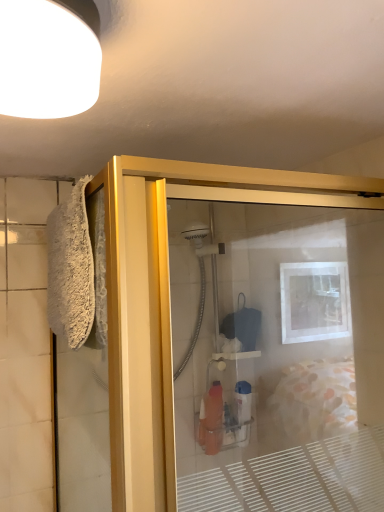
This screenshot has width=384, height=512. In order to click on gold metallic shower door at left in this screenshot , I will do `click(277, 351)`.

Describe the element at coordinates (49, 57) in the screenshot. I see `white matte light fixture at upper left` at that location.

This screenshot has height=512, width=384. I want to click on white fluffy bath towel at left, so click(71, 269).

Is gold metallic shower door at left bigger than white matte light fixture at upper left?

Yes, gold metallic shower door at left is bigger than white matte light fixture at upper left.

Could you tell me if gold metallic shower door at left is turned towards white matte light fixture at upper left?

No, gold metallic shower door at left is not turned towards white matte light fixture at upper left.

Can you confirm if white fluffy bath towel at left is taller than gold metallic shower door at left?

In fact, white fluffy bath towel at left may be shorter than gold metallic shower door at left.

Considering the relative sizes of white fluffy bath towel at left and gold metallic shower door at left in the image provided, is white fluffy bath towel at left thinner than gold metallic shower door at left?

Yes, white fluffy bath towel at left is thinner than gold metallic shower door at left.

Considering the points (88, 277) and (215, 218), which point is in front, point (88, 277) or point (215, 218)?

Point (88, 277)

Locate an element on the screen. This screenshot has height=512, width=384. light fixture above the gold metallic shower door at left (from a real-world perspective) is located at coordinates (49, 57).

How much distance is there between white matte light fixture at upper left and gold metallic shower door at left?

They are 88.74 centimeters apart.

How many degrees apart are the facing directions of white matte light fixture at upper left and gold metallic shower door at left?

The facing directions of white matte light fixture at upper left and gold metallic shower door at left are 89.5 degrees apart.

Consider the image. Does white matte light fixture at upper left have a lesser width compared to gold metallic shower door at left?

Indeed, white matte light fixture at upper left has a lesser width compared to gold metallic shower door at left.

In the image, is white matte light fixture at upper left positioned in front of or behind white fluffy bath towel at left?

Visually, white matte light fixture at upper left is located in front of white fluffy bath towel at left.

From a real-world perspective, who is located higher, white matte light fixture at upper left or white fluffy bath towel at left?

white matte light fixture at upper left.

Between white matte light fixture at upper left and white fluffy bath towel at left, which one has more height?

Standing taller between the two is white fluffy bath towel at left.

Is white matte light fixture at upper left to the left or to the right of white fluffy bath towel at left in the image?

Clearly, white matte light fixture at upper left is on the right of white fluffy bath towel at left in the image.

From a real-world perspective, is white fluffy bath towel at left on top of white matte light fixture at upper left?

Incorrect, from a real-world perspective, white fluffy bath towel at left is lower than white matte light fixture at upper left.

Could white matte light fixture at upper left be considered to be inside white fluffy bath towel at left?

No, white fluffy bath towel at left does not contain white matte light fixture at upper left.

Which object is further away from the camera taking this photo, white fluffy bath towel at left or white matte light fixture at upper left?

Positioned behind is white fluffy bath towel at left.

From the image's perspective, which object appears higher, white fluffy bath towel at left or white matte light fixture at upper left?

white matte light fixture at upper left, from the image's perspective.

Would you say white fluffy bath towel at left is part of gold metallic shower door at left's contents?

That's correct, white fluffy bath towel at left is inside gold metallic shower door at left.

From a real-world perspective, is gold metallic shower door at left located beneath white fluffy bath towel at left?

Yes, from a real-world perspective, gold metallic shower door at left is under white fluffy bath towel at left.

Which of these two, gold metallic shower door at left or white fluffy bath towel at left, is smaller?

white fluffy bath towel at left is smaller.

Locate an element on the screen. This screenshot has width=384, height=512. screen door in front of the white fluffy bath towel at left is located at coordinates (277, 351).

The height and width of the screenshot is (512, 384). What are the coordinates of `light fixture that appears above the gold metallic shower door at left (from a real-world perspective)` in the screenshot? It's located at 49,57.

The width and height of the screenshot is (384, 512). In the image, there is a white fluffy bath towel at left. Find the location of `screen door below it (from the image's perspective)`. screen door below it (from the image's perspective) is located at coordinates (277, 351).

When comparing their distances from white fluffy bath towel at left, does gold metallic shower door at left or white matte light fixture at upper left seem further?

gold metallic shower door at left is further to white fluffy bath towel at left.

Considering their positions, is white matte light fixture at upper left positioned closer to white fluffy bath towel at left than gold metallic shower door at left?

white matte light fixture at upper left is closer to white fluffy bath towel at left.

From the image, which object appears to be farther from gold metallic shower door at left, white matte light fixture at upper left or white fluffy bath towel at left?

Based on the image, white matte light fixture at upper left appears to be further to gold metallic shower door at left.

When comparing their distances from white matte light fixture at upper left, does white fluffy bath towel at left or gold metallic shower door at left seem closer?

white fluffy bath towel at left is positioned closer to the anchor white matte light fixture at upper left.

Considering their positions, is white fluffy bath towel at left positioned closer to gold metallic shower door at left than white matte light fixture at upper left?

white fluffy bath towel at left is closer to gold metallic shower door at left.

From the image, which object appears to be farther from white matte light fixture at upper left, gold metallic shower door at left or white fluffy bath towel at left?

gold metallic shower door at left is further to white matte light fixture at upper left.

Identify the location of bath towel between white matte light fixture at upper left and gold metallic shower door at left vertically. This screenshot has width=384, height=512. (71, 269).